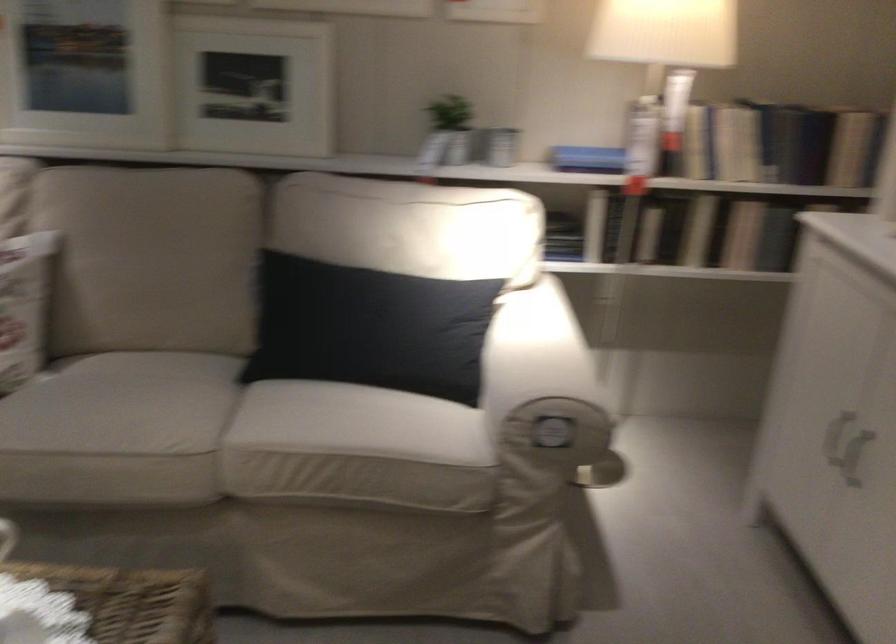
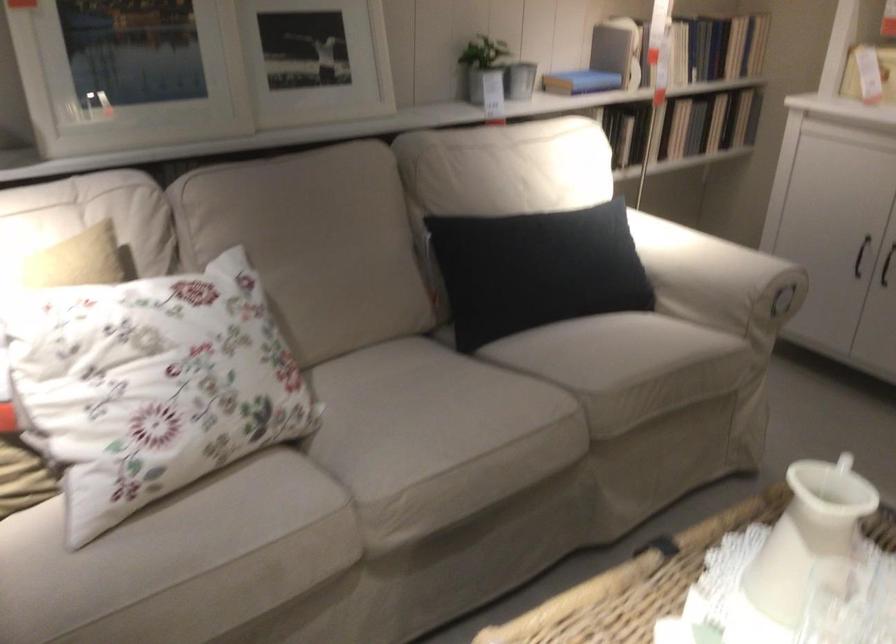
Find the pixel in the second image that matches pixel 340 323 in the first image.

(536, 270)